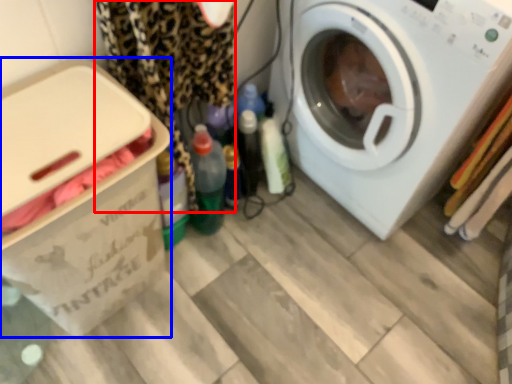
Question: Which object appears closest to the camera in this image, clothing (highlighted by a red box) or cardboard box (highlighted by a blue box)?

Choices:
 (A) clothing
 (B) cardboard box

Answer: (B)